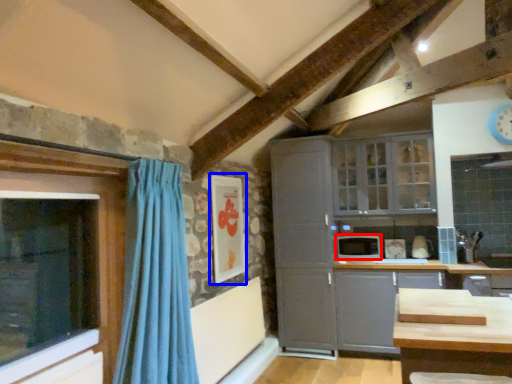
Question: Which of the following is the farthest to the observer, appliance (highlighted by a red box) or picture frame (highlighted by a blue box)?

Choices:
 (A) appliance
 (B) picture frame

Answer: (A)